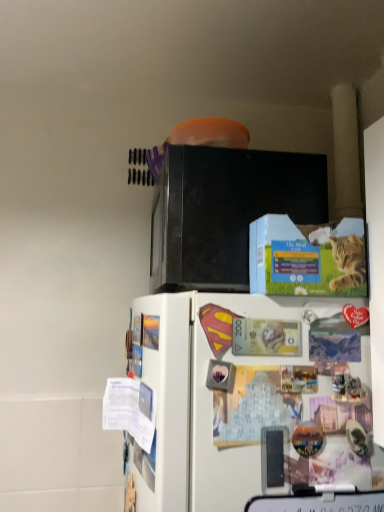
Question: Is black matte microwave oven at upper center situated inside white matte refrigerator at lower center or outside?

Choices:
 (A) inside
 (B) outside

Answer: (B)

Question: Is black matte microwave oven at upper center in front of or behind white matte refrigerator at lower center in the image?

Choices:
 (A) front
 (B) behind

Answer: (B)

Question: Estimate the real-world distances between objects in this image. Which object is closer to the white matte refrigerator at lower center?

Choices:
 (A) black matte microwave oven at upper center
 (B) blue cardboard box at upper center

Answer: (B)

Question: Which of these objects is positioned farthest from the black matte microwave oven at upper center?

Choices:
 (A) blue cardboard box at upper center
 (B) white matte refrigerator at lower center

Answer: (B)